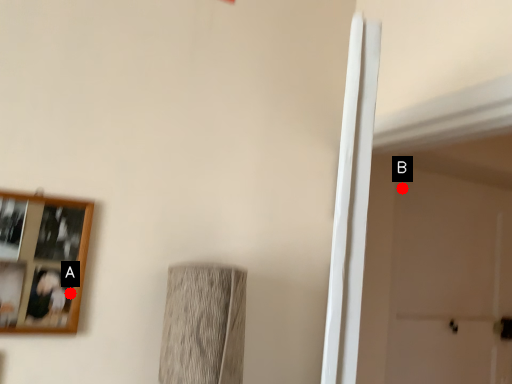
Question: Two points are circled on the image, labeled by A and B beside each circle. Among these points, which one is farthest from the camera?

Choices:
 (A) A is further
 (B) B is further

Answer: (B)